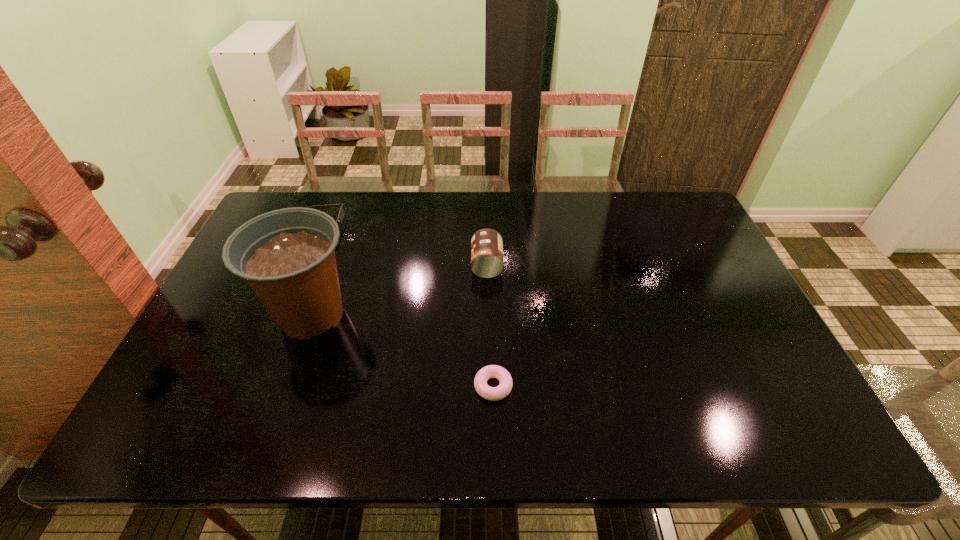
This screenshot has width=960, height=540. What are the coordinates of `free region located on the front label of the third nearest object` in the screenshot? It's located at (442, 264).

Identify the location of vacant space located on the front label of the third nearest object. (392, 264).

Locate an element on the screen. The image size is (960, 540). vacant region located 0.150m on the front-facing side of the spectacles is located at coordinates (386, 227).

The height and width of the screenshot is (540, 960). I want to click on vacant space located on the right of the nearest object, so click(615, 386).

Image resolution: width=960 pixels, height=540 pixels. In order to click on object located at the far edge in this screenshot , I will do `click(341, 212)`.

Identify the location of flowerpot that is at the left edge. The width and height of the screenshot is (960, 540). (287, 256).

Where is `spectacles present at the left edge`? The width and height of the screenshot is (960, 540). spectacles present at the left edge is located at coordinates (341, 212).

I want to click on object positioned at the far left corner, so click(x=341, y=212).

The height and width of the screenshot is (540, 960). I want to click on vacant area at the far edge of the desktop, so (x=440, y=198).

Locate an element on the screen. The width and height of the screenshot is (960, 540). vacant space at the left edge is located at coordinates (219, 309).